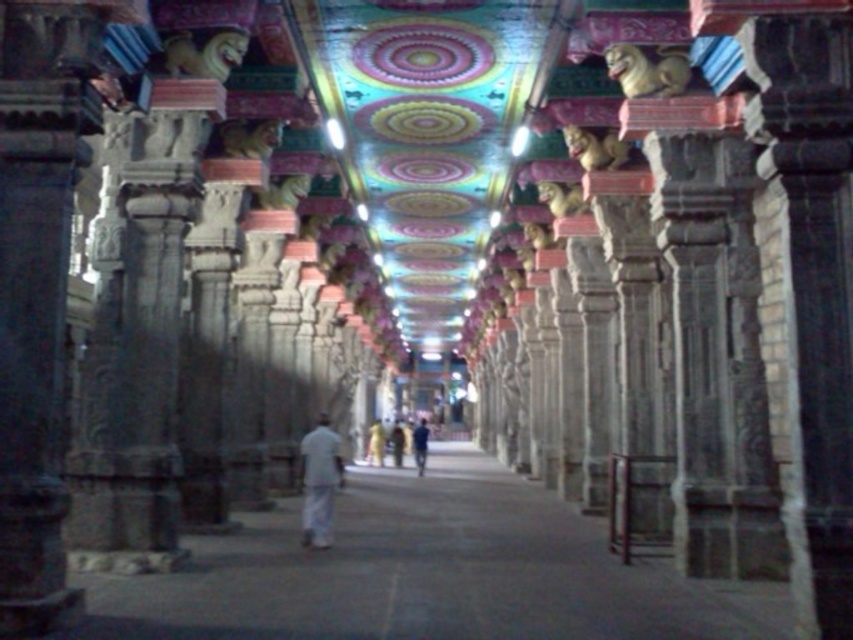
Question: Estimate the real-world distances between objects in this image. Which object is closer to the dark blue fabric at center?

Choices:
 (A) white cloth at center
 (B) golden stone lion at upper right
 (C) white cotton robe at center

Answer: (C)

Question: Is white cloth at center to the left of white cotton robe at center from the viewer's perspective?

Choices:
 (A) no
 (B) yes

Answer: (A)

Question: Estimate the real-world distances between objects in this image. Which object is farther from the dark blue fabric at center?

Choices:
 (A) white cotton robe at center
 (B) golden statue at upper center
 (C) white cloth at center

Answer: (C)

Question: Which of the following is the closest to the observer?

Choices:
 (A) dark blue fabric at center
 (B) white cloth at center

Answer: (B)

Question: Does white cloth at center appear on the left side of golden statue at upper center?

Choices:
 (A) yes
 (B) no

Answer: (A)

Question: Can you confirm if white cloth at center is positioned to the right of white cotton robe at center?

Choices:
 (A) yes
 (B) no

Answer: (A)